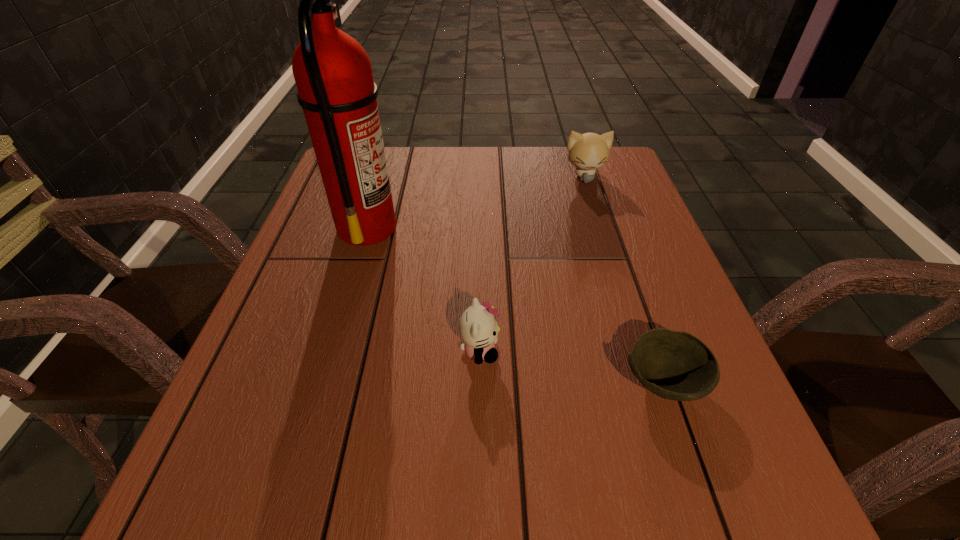
This screenshot has width=960, height=540. I want to click on vacant space in between the right kitten and the third object from right to left, so click(532, 264).

Select which object is the third closest to the bowl. Please provide its 2D coordinates. Your answer should be formatted as a tuple, i.e. [(x, y)], where the tuple contains the x and y coordinates of a point satisfying the conditions above.

[(589, 151)]

Point out which object is positioned as the third nearest to the leftmost object. Please provide its 2D coordinates. Your answer should be formatted as a tuple, i.e. [(x, y)], where the tuple contains the x and y coordinates of a point satisfying the conditions above.

[(675, 365)]

The width and height of the screenshot is (960, 540). I want to click on blank area in the image that satisfies the following two spatial constraints: 1. on the face of the bowl; 2. on the left side of the right kitten, so click(650, 382).

Find the location of `free space that satisfies the following two spatial constraints: 1. on the face of the farthest object; 2. on the front-facing side of the nearer kitten`. free space that satisfies the following two spatial constraints: 1. on the face of the farthest object; 2. on the front-facing side of the nearer kitten is located at coordinates (640, 351).

Image resolution: width=960 pixels, height=540 pixels. Identify the location of vacant position in the image that satisfies the following two spatial constraints: 1. on the face of the farthest object; 2. on the front-facing side of the nearer kitten. [x=640, y=351].

Identify the location of vacant region that satisfies the following two spatial constraints: 1. on the front-facing side of the left kitten; 2. on the back side of the bowl. (480, 382).

Image resolution: width=960 pixels, height=540 pixels. I want to click on free region that satisfies the following two spatial constraints: 1. on the side of the tallest object near the handle; 2. on the back side of the shortest object, so click(321, 382).

The image size is (960, 540). In order to click on vacant region that satisfies the following two spatial constraints: 1. on the side of the fire extinguisher near the handle; 2. on the back side of the bowl in this screenshot , I will do `click(321, 382)`.

The image size is (960, 540). In order to click on vacant space that satisfies the following two spatial constraints: 1. on the side of the leftmost object near the handle; 2. on the right side of the bowl in this screenshot , I will do `click(321, 382)`.